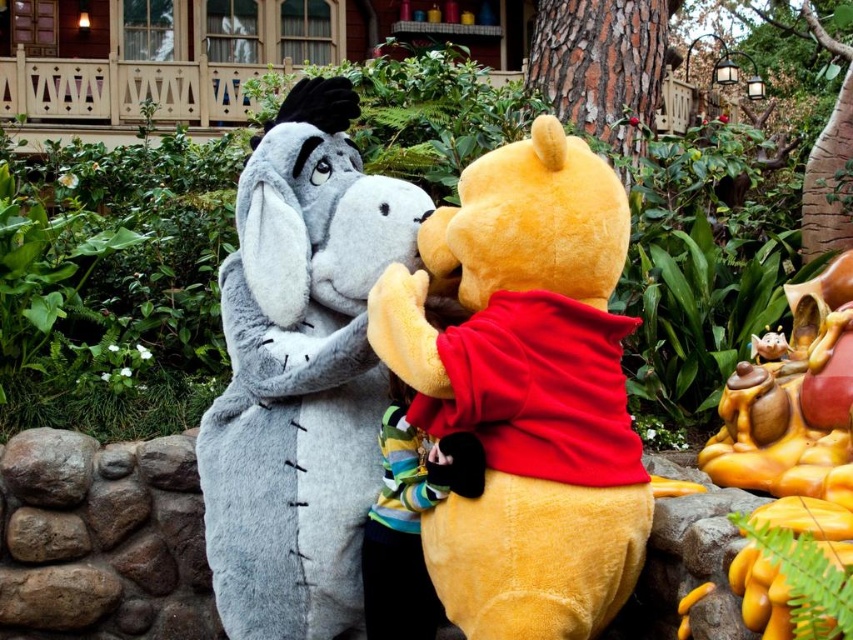
You are a photographer trying to capture the perfect shot of the fluffy yellow bear at center. According to the coordinates provided, where exactly should you aim your camera to ensure the bear is centered in your frame?

The fluffy yellow bear at center is located at coordinates point (x=527, y=390), so you should aim your camera at that exact point to center the bear in your frame.

You are a photographer trying to capture the two points in the image. Which point, point [724,484] or point [396,426], is closer to your camera?

Point [724,484] is further to the viewer than point [396,426], so the closer point to the camera is point [396,426].